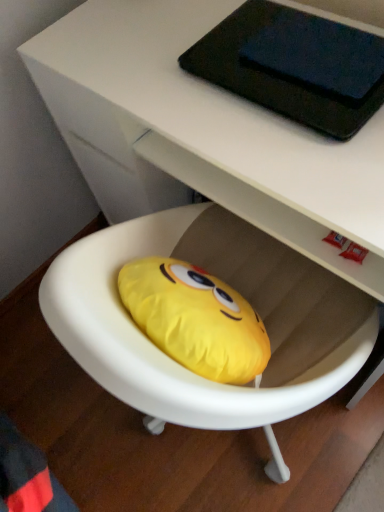
Describe the element at coordinates (240, 292) in the screenshot. I see `yellow fabric bean bag at center` at that location.

Where is `yellow fabric bean bag at center`? yellow fabric bean bag at center is located at coordinates (240, 292).

What is the approximate width of yellow fabric bean bag at center?

It is 27.14 inches.

Measure the distance between black matte tablet at upper center and camera.

The depth of black matte tablet at upper center is 68.14 centimeters.

Image resolution: width=384 pixels, height=512 pixels. Describe the element at coordinates (294, 66) in the screenshot. I see `black matte tablet at upper center` at that location.

I want to click on black matte tablet at upper center, so click(x=294, y=66).

This screenshot has width=384, height=512. I want to click on yellow fabric bean bag at center, so click(240, 292).

Is yellow fabric bean bag at center to the left or to the right of black matte tablet at upper center in the image?

yellow fabric bean bag at center is to the left of black matte tablet at upper center.

Considering the positions of objects yellow fabric bean bag at center and black matte tablet at upper center in the image provided, who is behind, yellow fabric bean bag at center or black matte tablet at upper center?

black matte tablet at upper center is more distant.

Does point (71, 271) come behind point (294, 38)?

No.

From the image's perspective, is yellow fabric bean bag at center located above or below black matte tablet at upper center?

Based on their image positions, yellow fabric bean bag at center is located beneath black matte tablet at upper center.

From a real-world perspective, is yellow fabric bean bag at center on top of black matte tablet at upper center?

Actually, yellow fabric bean bag at center is physically below black matte tablet at upper center in the real world.

Is yellow fabric bean bag at center thinner than black matte tablet at upper center?

Incorrect, the width of yellow fabric bean bag at center is not less than that of black matte tablet at upper center.

Can you confirm if yellow fabric bean bag at center is taller than black matte tablet at upper center?

Yes.

Based on their sizes in the image, would you say yellow fabric bean bag at center is bigger or smaller than black matte tablet at upper center?

In the image, yellow fabric bean bag at center appears to be larger than black matte tablet at upper center.

Is yellow fabric bean bag at center completely or partially outside of black matte tablet at upper center?

yellow fabric bean bag at center lies outside black matte tablet at upper center's area.

Is yellow fabric bean bag at center in contact with black matte tablet at upper center?

yellow fabric bean bag at center is not next to black matte tablet at upper center, and they're not touching.

Is yellow fabric bean bag at center turned away from black matte tablet at upper center?

That's not correct — yellow fabric bean bag at center is not looking away from black matte tablet at upper center.

Measure the distance from yellow fabric bean bag at center to black matte tablet at upper center.

yellow fabric bean bag at center is 14.72 inches from black matte tablet at upper center.

Where is `bean bag chair in front of the black matte tablet at upper center`? bean bag chair in front of the black matte tablet at upper center is located at coordinates (240, 292).

Based on their positions, is black matte tablet at upper center located to the left or right of yellow fabric bean bag at center?

black matte tablet at upper center is positioned on yellow fabric bean bag at center's right side.

From the picture: In the image, is black matte tablet at upper center positioned in front of or behind yellow fabric bean bag at center?

Visually, black matte tablet at upper center is located behind yellow fabric bean bag at center.

Is point (263, 81) positioned behind point (286, 306)?

No, it is in front of (286, 306).

From the image's perspective, who appears lower, black matte tablet at upper center or yellow fabric bean bag at center?

yellow fabric bean bag at center appears lower in the image.

From a real-world perspective, relative to yellow fabric bean bag at center, is black matte tablet at upper center vertically above or below?

black matte tablet at upper center is above yellow fabric bean bag at center.

Is black matte tablet at upper center thinner than yellow fabric bean bag at center?

Yes, black matte tablet at upper center is thinner than yellow fabric bean bag at center.

Can you confirm if black matte tablet at upper center is shorter than yellow fabric bean bag at center?

Correct, black matte tablet at upper center is not as tall as yellow fabric bean bag at center.

Who is smaller, black matte tablet at upper center or yellow fabric bean bag at center?

black matte tablet at upper center is smaller.

Would you say yellow fabric bean bag at center is part of black matte tablet at upper center's contents?

No, yellow fabric bean bag at center is located outside of black matte tablet at upper center.

Is black matte tablet at upper center far from yellow fabric bean bag at center?

No, black matte tablet at upper center is not far from yellow fabric bean bag at center.

Is black matte tablet at upper center facing away from yellow fabric bean bag at center?

Absolutely, black matte tablet at upper center is directed away from yellow fabric bean bag at center.

Consider the image. How much distance is there between black matte tablet at upper center and yellow fabric bean bag at center?

They are 14.72 inches apart.

Identify the location of tablet computer that is above the yellow fabric bean bag at center (from a real-world perspective). (294, 66).

Identify the location of tablet computer that is above the yellow fabric bean bag at center (from a real-world perspective). Image resolution: width=384 pixels, height=512 pixels. 294,66.

In order to click on tablet computer that is on the right side of yellow fabric bean bag at center in this screenshot , I will do `click(294, 66)`.